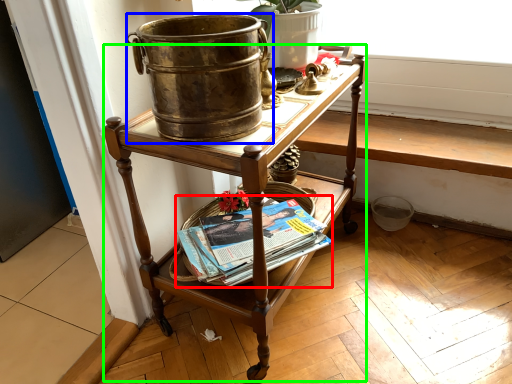
Question: Which is farther away from paperback book (highlighted by a red box)? flowerpot (highlighted by a blue box) or desk (highlighted by a green box)?

Choices:
 (A) flowerpot
 (B) desk

Answer: (A)